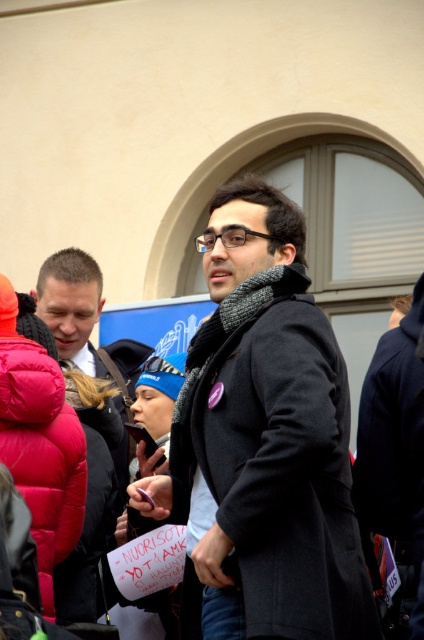
Can you confirm if black woolen coat at center is positioned to the right of matte pink puffer jacket at left?

Indeed, black woolen coat at center is positioned on the right side of matte pink puffer jacket at left.

Between point (328, 458) and point (19, 362), which one is positioned in front?

Point (328, 458)

Locate an element on the screen. black woolen coat at center is located at coordinates (276, 458).

Who is shorter, matte pink puffer jacket at left or knitted wool scarf at center?

knitted wool scarf at center is shorter.

Can you confirm if matte pink puffer jacket at left is smaller than knitted wool scarf at center?

No.

You are a GUI agent. You are given a task and a screenshot of the screen. Output one action in this format:
    pyautogui.click(x=<x>, y=<y>)
    Task: Click on the matte pink puffer jacket at left
    
    Given the screenshot: What is the action you would take?
    pyautogui.click(x=39, y=444)

This screenshot has width=424, height=640. I want to click on matte pink puffer jacket at left, so click(x=39, y=444).

Is matte pink puffer jacket at left taller than blue knit cap at center?

Indeed, matte pink puffer jacket at left has a greater height compared to blue knit cap at center.

Is matte pink puffer jacket at left above blue knit cap at center?

Yes, matte pink puffer jacket at left is above blue knit cap at center.

The image size is (424, 640). What do you see at coordinates (39, 444) in the screenshot?
I see `matte pink puffer jacket at left` at bounding box center [39, 444].

The image size is (424, 640). In order to click on matte pink puffer jacket at left in this screenshot , I will do `click(39, 444)`.